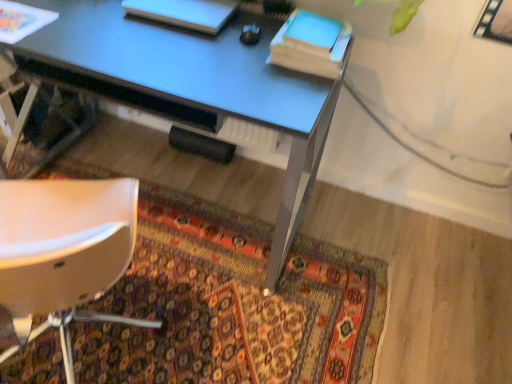
Where is `empty space that is ontop of white matte book at upper center, the first book in the left-to-right sequence (from a real-world perspective)`? This screenshot has height=384, width=512. empty space that is ontop of white matte book at upper center, the first book in the left-to-right sequence (from a real-world perspective) is located at coordinates (182, 10).